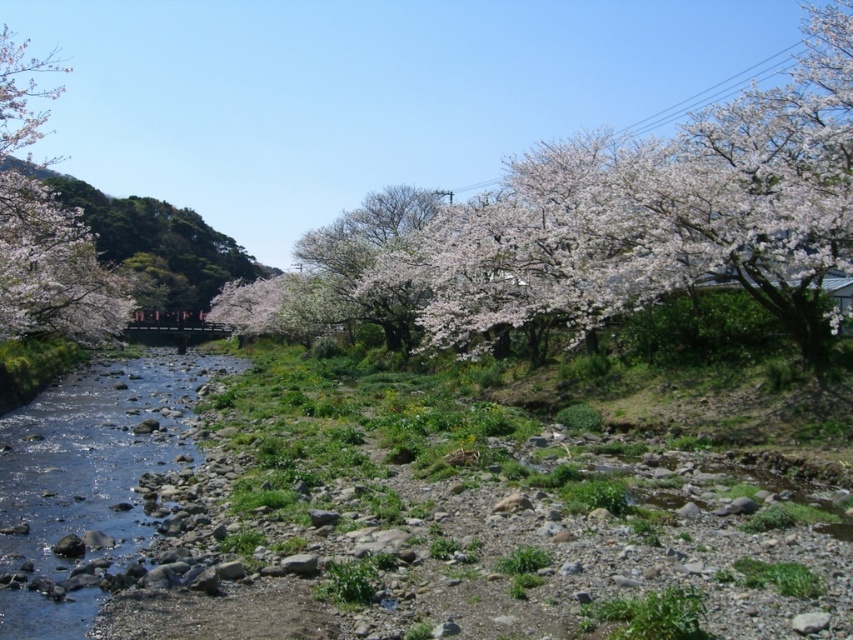
Can you confirm if white blossoming tree at upper center is shorter than clear water at river left?

No, white blossoming tree at upper center is not shorter than clear water at river left.

Is white blossoming tree at upper center taller than clear water at river left?

Yes.

Is point (729, 216) in front of point (88, 400)?

That is True.

Image resolution: width=853 pixels, height=640 pixels. In order to click on white blossoming tree at upper center in this screenshot , I will do `click(659, 212)`.

Who is taller, white blossoming tree at upper center or white blossoming tree at left?

white blossoming tree at left

Can you confirm if white blossoming tree at upper center is positioned to the left of white blossoming tree at left?

Incorrect, white blossoming tree at upper center is not on the left side of white blossoming tree at left.

This screenshot has width=853, height=640. What are the coordinates of `white blossoming tree at upper center` in the screenshot? It's located at (659, 212).

Where is `white blossoming tree at upper center`? This screenshot has width=853, height=640. white blossoming tree at upper center is located at coordinates (659, 212).

Between clear water at river left and white blossoming tree at left, which one is positioned lower?

clear water at river left is below.

Can you confirm if clear water at river left is positioned below white blossoming tree at left?

Yes, clear water at river left is below white blossoming tree at left.

Is point (39, 433) positioned behind point (25, 209)?

Yes.

Where is `clear water at river left`? The image size is (853, 640). clear water at river left is located at coordinates (96, 456).